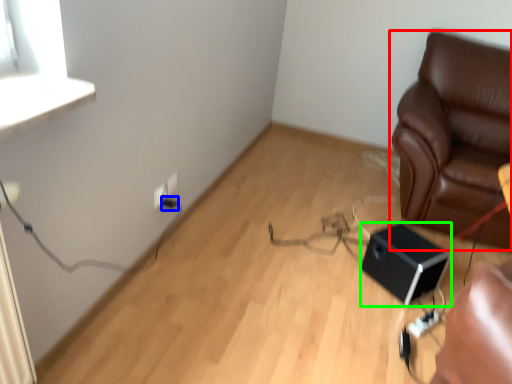
Question: Which is nearer to the furniture (highlighted by a red box)? electric outlet (highlighted by a blue box) or speaker (highlighted by a green box).

Choices:
 (A) electric outlet
 (B) speaker

Answer: (B)